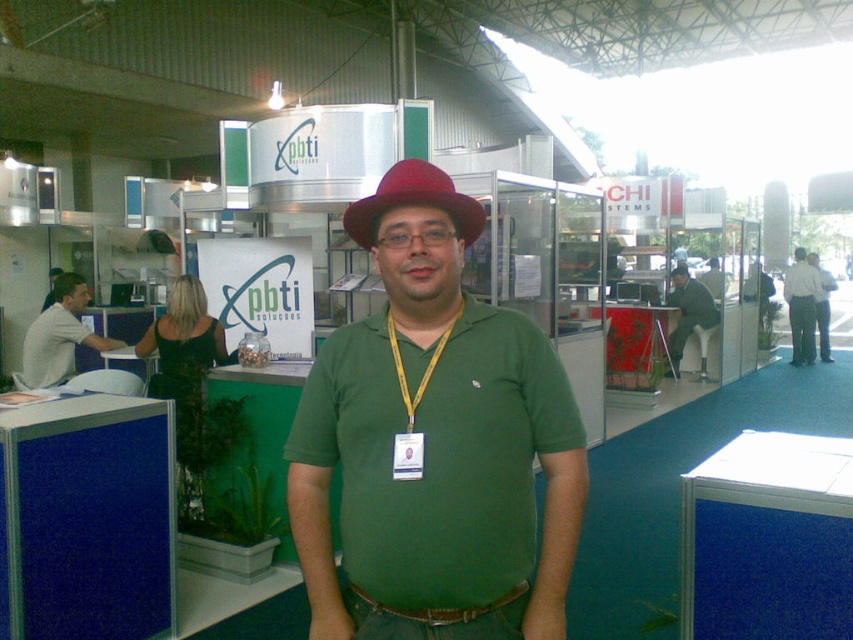
Who is more distant from viewer, (473, 490) or (363, 241)?

The point (363, 241) is more distant.

Can you confirm if green matte shirt at center is positioned below red felt fedora at center?

Correct, green matte shirt at center is located below red felt fedora at center.

Identify the location of green matte shirt at center. The height and width of the screenshot is (640, 853). (434, 442).

Can you confirm if red felt fedora at center is positioned to the left of light gray shirt at left?

Incorrect, red felt fedora at center is not on the left side of light gray shirt at left.

Is red felt fedora at center smaller than light gray shirt at left?

Yes, red felt fedora at center is smaller than light gray shirt at left.

What do you see at coordinates (413, 202) in the screenshot? I see `red felt fedora at center` at bounding box center [413, 202].

Locate an element on the screen. The image size is (853, 640). red felt fedora at center is located at coordinates (413, 202).

This screenshot has height=640, width=853. Describe the element at coordinates (822, 305) in the screenshot. I see `white shirt at center` at that location.

Does white shirt at center appear over matte red hat at center?

Yes.

Where is `white shirt at center`? This screenshot has height=640, width=853. white shirt at center is located at coordinates (822, 305).

Where is `white shirt at center`? The width and height of the screenshot is (853, 640). white shirt at center is located at coordinates (822, 305).